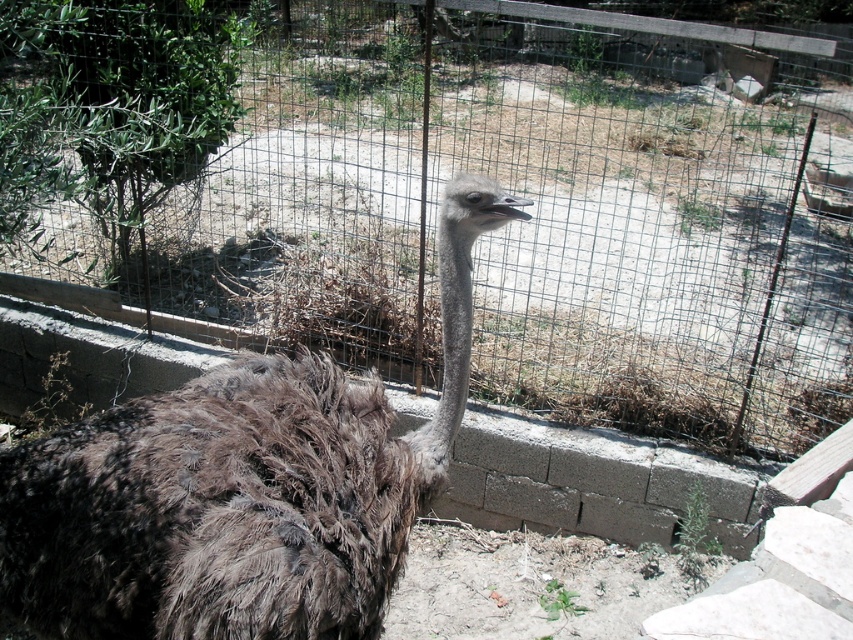
You are a zookeeper trying to ensure the ostrich stays within the enclosure. Based on the image, do you think the wire mesh fence at center is tall enough to prevent the brown fuzzy ostrich at center from jumping over it?

The wire mesh fence at center has a greater height compared to brown fuzzy ostrich at center, so it is likely tall enough to prevent the ostrich from jumping over it.

You are a zookeeper trying to feed an ostrich. You have a bucket of feed in your hand. The brown fuzzy ostrich at center and the brown feathered ostrich head at center are both in your line of sight. Which one should you aim the feed at to ensure it reaches the ostrich first?

You should aim the feed at the brown fuzzy ostrich at center because it is closer to the viewer than the brown feathered ostrich head at center, so it will reach it first.